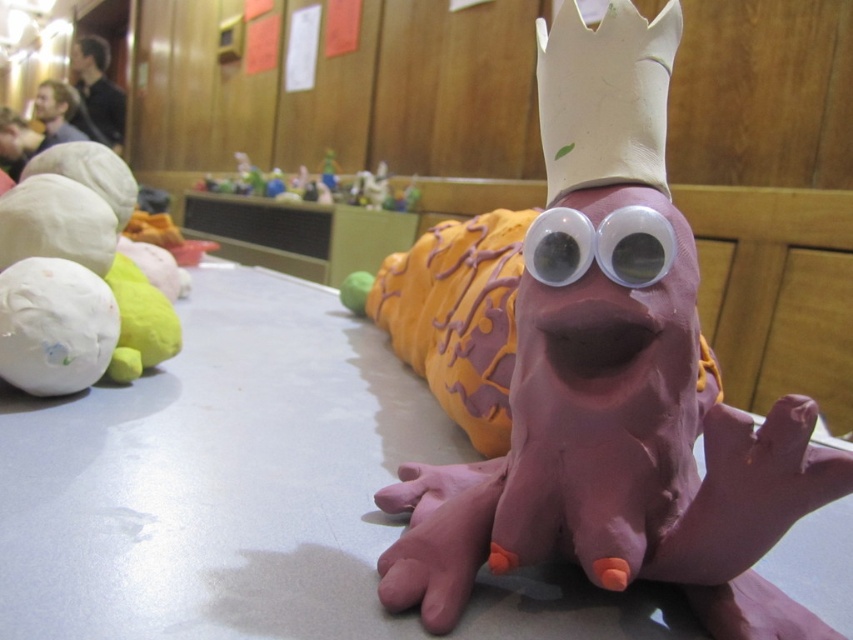
You are an artist examining the sculpture. You notice the pink clay snail at center and the translucent plastic eye at center. Which object would appear larger to you if you look at them from your current viewpoint?

The pink clay snail at center would appear larger because it is closer to the viewer than the translucent plastic eye at center.

You are a child who wants to place the pink clay snail at center and the smooth plastic toys at center on a shelf. The shelf has a width of 10 cm. Can both items fit side by side without overlapping?

The pink clay snail at center is narrower than the smooth plastic toys at center. However, without knowing the exact widths of both items, it is impossible to determine if their combined width exceeds 10 cm. More information is needed.

Based on the coordinates provided, where is the pink clay snail at center located in the image?

The pink clay snail at center is located at the coordinates point (x=614, y=387).